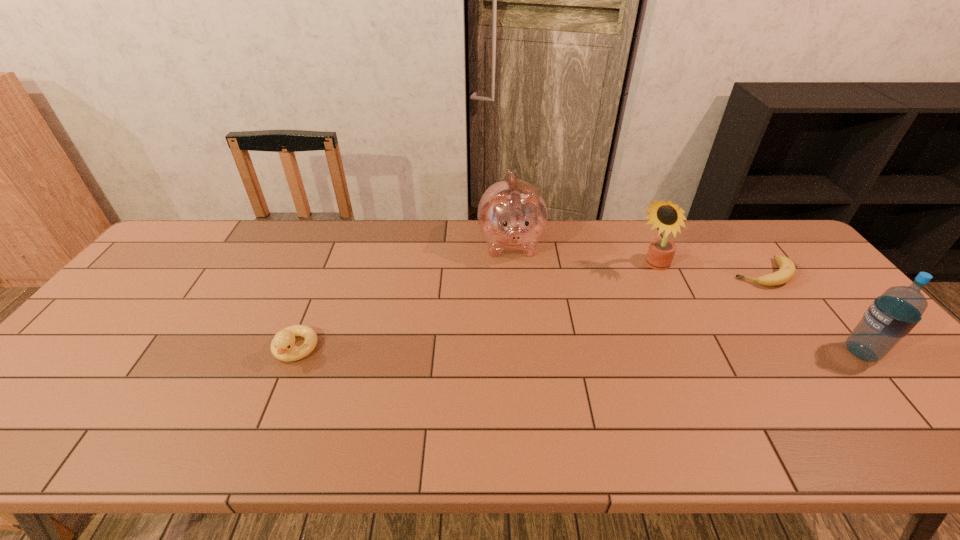
Locate an element on the screen. This screenshot has width=960, height=540. empty space between the water bottle and the piggy bank is located at coordinates (686, 299).

You are a GUI agent. You are given a task and a screenshot of the screen. Output one action in this format:
    pyautogui.click(x=<x>, y=<y>)
    Task: Click on the vacant area between the water bottle and the banana
    
    Given the screenshot: What is the action you would take?
    pyautogui.click(x=812, y=313)

This screenshot has width=960, height=540. I want to click on free space between the water bottle and the shortest object, so click(x=812, y=313).

Where is `blank region between the fourth tallest object and the fourth object from right to left`? blank region between the fourth tallest object and the fourth object from right to left is located at coordinates (403, 297).

Identify the location of free space between the duckling and the shortest object. The image size is (960, 540). (529, 312).

The image size is (960, 540). What are the coordinates of `free space that is in between the shortest object and the piggy bank` in the screenshot? It's located at (636, 259).

You are a GUI agent. You are given a task and a screenshot of the screen. Output one action in this format:
    pyautogui.click(x=<x>, y=<y>)
    Task: Click on the vacant area that lies between the water bottle and the duckling
    This screenshot has width=960, height=540.
    Given the screenshot: What is the action you would take?
    pyautogui.click(x=578, y=351)

At what (x,y) coordinates should I click in order to perform the action: click on free space between the banana and the duckling. Please return your answer as a coordinate pair (x, y). The width and height of the screenshot is (960, 540). Looking at the image, I should click on (529, 312).

Where is `vacant point located between the second shortest object and the banana`? vacant point located between the second shortest object and the banana is located at coordinates (529, 312).

Locate which object is the second closest to the water bottle. Please provide its 2D coordinates. Your answer should be formatted as a tuple, i.e. [(x, y)], where the tuple contains the x and y coordinates of a point satisfying the conditions above.

[(667, 216)]